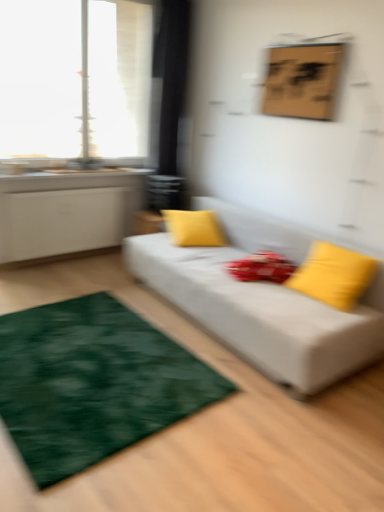
Question: From a real-world perspective, is transparent glass window at upper left located higher than white fabric couch at center?

Choices:
 (A) yes
 (B) no

Answer: (A)

Question: Is the depth of transparent glass window at upper left greater than that of white fabric couch at center?

Choices:
 (A) yes
 (B) no

Answer: (A)

Question: From the image's perspective, is transparent glass window at upper left on top of white fabric couch at center?

Choices:
 (A) yes
 (B) no

Answer: (A)

Question: Could you tell me if transparent glass window at upper left is turned towards white fabric couch at center?

Choices:
 (A) yes
 (B) no

Answer: (A)

Question: Is transparent glass window at upper left shorter than white fabric couch at center?

Choices:
 (A) yes
 (B) no

Answer: (B)

Question: Is transparent glass window at upper left wider than white fabric couch at center?

Choices:
 (A) yes
 (B) no

Answer: (B)

Question: Can you confirm if transparent glass window at upper left is taller than green plush rug at lower left?

Choices:
 (A) yes
 (B) no

Answer: (A)

Question: From a real-world perspective, is transparent glass window at upper left located beneath green plush rug at lower left?

Choices:
 (A) yes
 (B) no

Answer: (B)

Question: Considering the relative sizes of transparent glass window at upper left and green plush rug at lower left in the image provided, is transparent glass window at upper left shorter than green plush rug at lower left?

Choices:
 (A) yes
 (B) no

Answer: (B)

Question: Is green plush rug at lower left a part of transparent glass window at upper left?

Choices:
 (A) yes
 (B) no

Answer: (B)

Question: Is transparent glass window at upper left next to green plush rug at lower left?

Choices:
 (A) yes
 (B) no

Answer: (B)

Question: Could you tell me if transparent glass window at upper left is facing green plush rug at lower left?

Choices:
 (A) yes
 (B) no

Answer: (B)

Question: Is yellow fabric pillow at center, the first pillow when ordered from left to right, surrounded by transparent glass window at upper left?

Choices:
 (A) yes
 (B) no

Answer: (B)